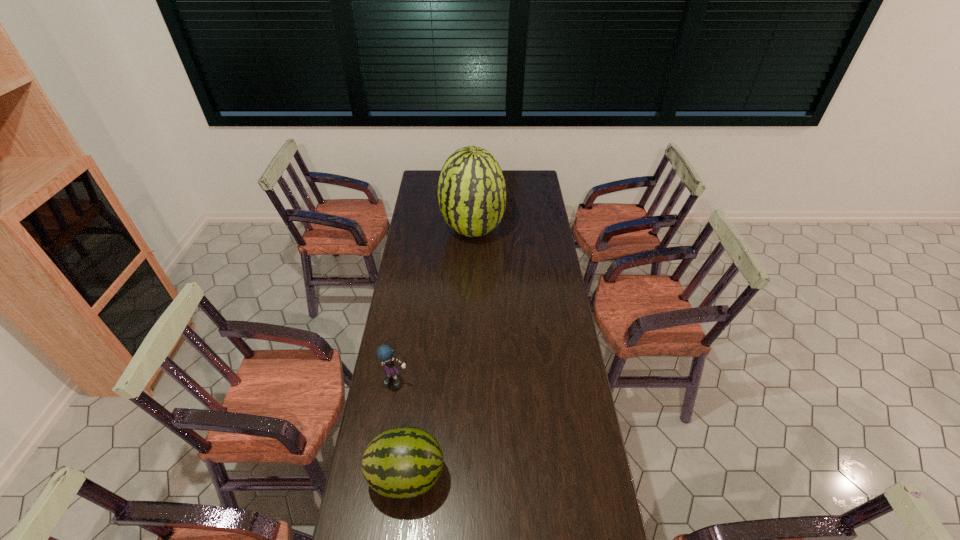
You are a GUI agent. You are given a task and a screenshot of the screen. Output one action in this format:
    pyautogui.click(x=<x>, y=<y>)
    Task: Click on the vacant region at the left edge of the desktop
    
    Given the screenshot: What is the action you would take?
    pyautogui.click(x=418, y=383)

The height and width of the screenshot is (540, 960). I want to click on free space at the right edge of the desktop, so click(554, 314).

This screenshot has width=960, height=540. I want to click on free space at the far right corner of the desktop, so click(525, 176).

This screenshot has height=540, width=960. What are the coordinates of `empty space between the second farthest object and the tallest object` in the screenshot? It's located at (435, 307).

Where is `free spot between the farther watermelon and the shorter watermelon`? Image resolution: width=960 pixels, height=540 pixels. free spot between the farther watermelon and the shorter watermelon is located at coordinates (440, 354).

You are a GUI agent. You are given a task and a screenshot of the screen. Output one action in this format:
    pyautogui.click(x=<x>, y=<y>)
    Task: Click on the vacant space that's between the taller watermelon and the rag doll
    
    Given the screenshot: What is the action you would take?
    pyautogui.click(x=435, y=307)

Locate which object is the second closest to the tallest object. Please provide its 2D coordinates. Your answer should be formatted as a tuple, i.e. [(x, y)], where the tuple contains the x and y coordinates of a point satisfying the conditions above.

[(405, 462)]

At what (x,y) coordinates should I click in order to perform the action: click on object that is the second nearest to the shorter watermelon. Please return your answer as a coordinate pair (x, y). The height and width of the screenshot is (540, 960). Looking at the image, I should click on (471, 190).